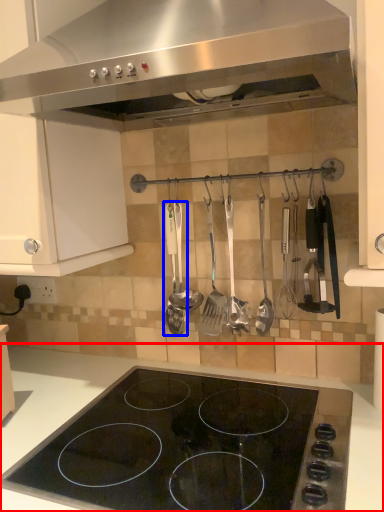
Question: Which point is further to the camera, countertop (highlighted by a red box) or silverware (highlighted by a blue box)?

Choices:
 (A) countertop
 (B) silverware

Answer: (B)